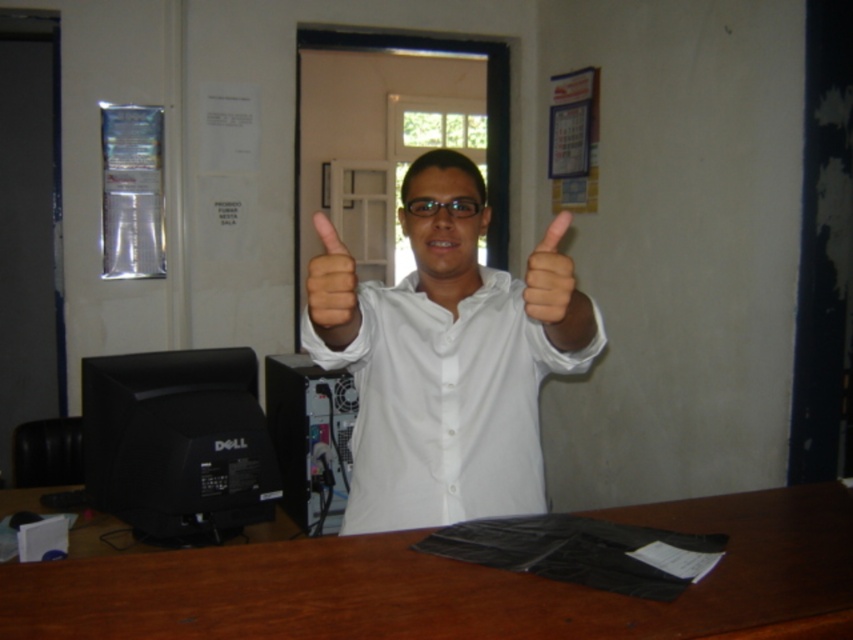
You are organizing a small meeting and need to place a 1.2 meter wide laptop on the desk. Given the brown wood table at center and the white glossy shirt at center, can the laptop fit on the table?

The brown wood table at center has a width larger than the white glossy shirt at center. Since the shirt is part of the person and not the table, the table width is sufficient to accommodate the 1.2 meter wide laptop.

You are a photographer trying to capture a closeup of the brown wood table at center. However, the skinny white hand at center is blocking your view. Can you still take the photo without moving the hand?

The brown wood table at center is closer to the viewer than the skinny white hand at center, so you can take the photo without moving the hand because the table is in front of the hand and not blocked.

You are a delivery person trying to place a large package on the brown wood table at center. The package is 1.2 meters wide. Can the skinny white hand at center help you determine if the table is wide enough?

The brown wood table at center might be wider than the skinny white hand at center, so if the hand is part of the person standing next to the table, the table could potentially accommodate the 1.2 meter wide package. However, without exact measurements, it is uncertain. Consider checking the table dimensions before placing the package.